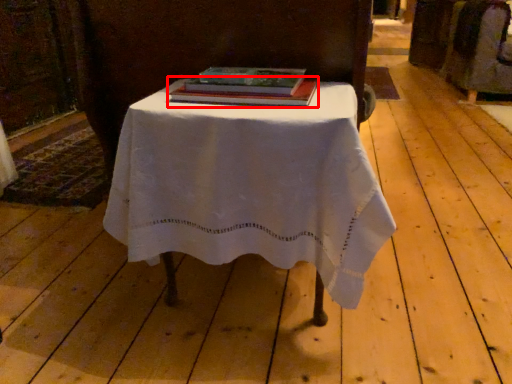
Question: From the image's perspective, where is book (annotated by the red box) located relative to table?

Choices:
 (A) above
 (B) below

Answer: (A)